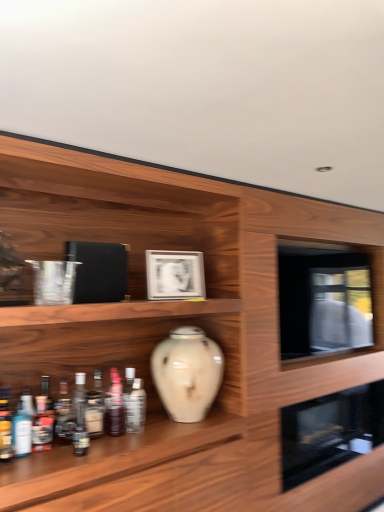
Question: Is matte silver picture frame at center at the left side of translucent glass bottle at lower left, positioned as the 7th bottle in left-to-right order?

Choices:
 (A) yes
 (B) no

Answer: (B)

Question: From the image's perspective, is matte silver picture frame at center below translucent glass bottle at lower left, which is counted as the second bottle, starting from the right?

Choices:
 (A) no
 (B) yes

Answer: (A)

Question: Is matte silver picture frame at center beside translucent glass bottle at lower left, which is counted as the second bottle, starting from the right?

Choices:
 (A) no
 (B) yes

Answer: (A)

Question: Is matte silver picture frame at center aimed at translucent glass bottle at lower left, positioned as the 7th bottle in left-to-right order?

Choices:
 (A) no
 (B) yes

Answer: (A)

Question: Can you confirm if matte silver picture frame at center is positioned to the right of translucent glass bottle at lower left, which is counted as the second bottle, starting from the right?

Choices:
 (A) no
 (B) yes

Answer: (B)

Question: Can translucent glass bottle at lower left, which is counted as the second bottle, starting from the right, be found inside matte silver picture frame at center?

Choices:
 (A) no
 (B) yes

Answer: (A)

Question: Is white glossy vase at center next to black glass oven at lower right, marked as the 2th oven in a top-to-bottom arrangement?

Choices:
 (A) no
 (B) yes

Answer: (A)

Question: From a real-world perspective, does white glossy vase at center stand above black glass oven at lower right, arranged as the 1th oven when ordered from the bottom?

Choices:
 (A) yes
 (B) no

Answer: (A)

Question: Is black glass oven at lower right, arranged as the 1th oven when ordered from the bottom, at the back of white glossy vase at center?

Choices:
 (A) no
 (B) yes

Answer: (B)

Question: Would you say white glossy vase at center contains black glass oven at lower right, marked as the 2th oven in a top-to-bottom arrangement?

Choices:
 (A) yes
 (B) no

Answer: (A)

Question: Considering the relative sizes of white glossy vase at center and black glass oven at lower right, arranged as the 1th oven when ordered from the bottom, in the image provided, is white glossy vase at center thinner than black glass oven at lower right, arranged as the 1th oven when ordered from the bottom,?

Choices:
 (A) yes
 (B) no

Answer: (B)

Question: Is the depth of white glossy vase at center less than that of black glass oven at lower right, marked as the 2th oven in a top-to-bottom arrangement?

Choices:
 (A) no
 (B) yes

Answer: (B)

Question: Is white glossy vase at center inside matte silver picture frame at center?

Choices:
 (A) yes
 (B) no

Answer: (B)